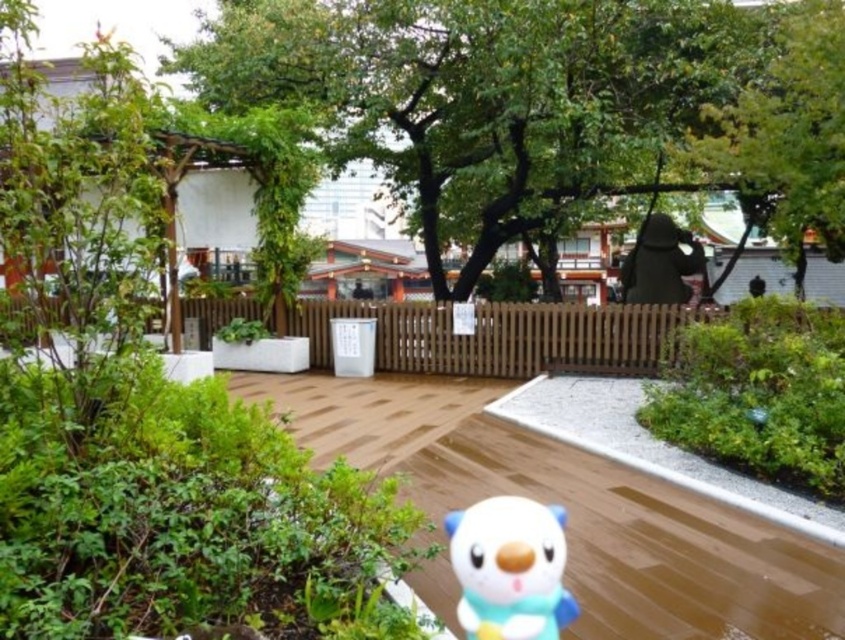
Who is more distant from viewer, (x=472, y=216) or (x=549, y=515)?

Point (x=472, y=216)

Which is in front, point (657, 44) or point (507, 525)?

Positioned in front is point (507, 525).

I want to click on green leafy tree at center, so click(x=549, y=104).